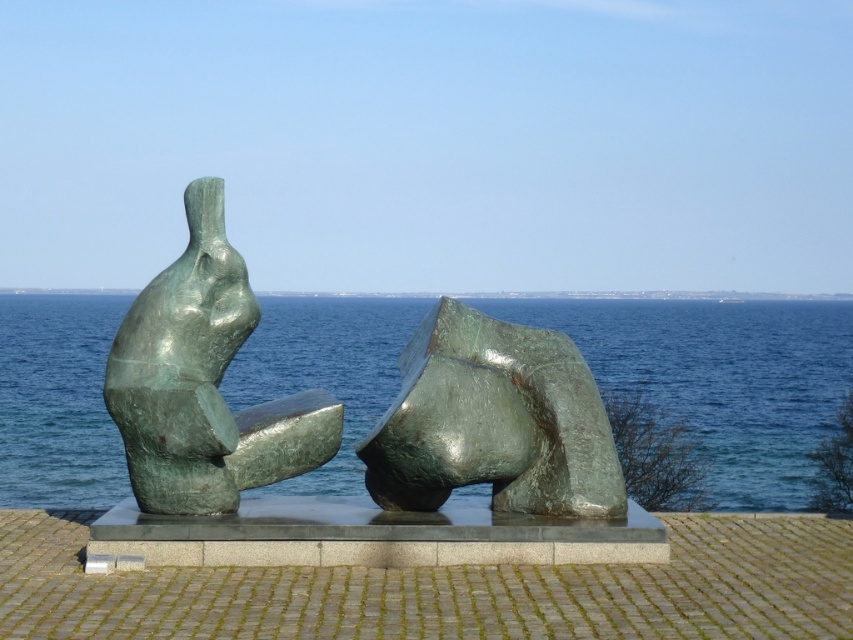
You are an artist planning to photograph both the green metallic water at center and the green polished stone abstract form at center. Which of the two objects has a greater width in the scene?

The green metallic water at center has a greater width than the green polished stone abstract form at center according to the description provided.

You are an art student analyzing the sculptures in the image. You notice the green polished stone abstract form at center and the green patina sculpture at left. Which sculpture is closer to the water?

The green patina sculpture at left is closer to the water because the green polished stone abstract form at center is positioned on the right side of it, implying the green patina sculpture at left is nearer to the water body.